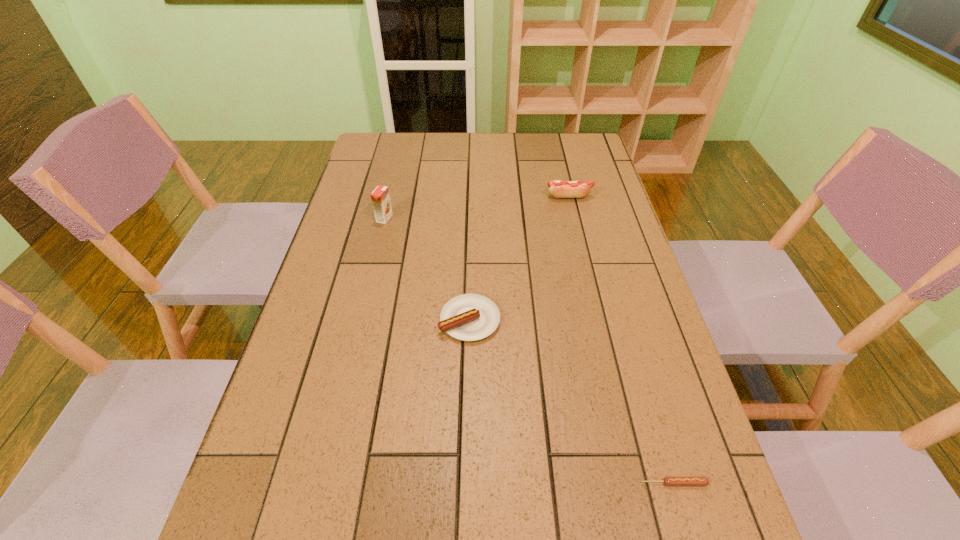
Image resolution: width=960 pixels, height=540 pixels. In order to click on the third nearest object in this screenshot , I will do `click(380, 197)`.

You are a GUI agent. You are given a task and a screenshot of the screen. Output one action in this format:
    pyautogui.click(x=<x>, y=<y>)
    Task: Click on the orange juice
    This screenshot has width=960, height=540.
    Given the screenshot: What is the action you would take?
    coord(380,197)

Where is `the farthest object`? Image resolution: width=960 pixels, height=540 pixels. the farthest object is located at coordinates (560, 189).

What are the coordinates of `the farthest sausage` in the screenshot? It's located at (560, 189).

Identify the location of the leftmost sausage. (468, 317).

Where is `the second tallest sausage`? the second tallest sausage is located at coordinates (468, 317).

Find the location of `the nearest object`. the nearest object is located at coordinates (668, 481).

Image resolution: width=960 pixels, height=540 pixels. Identify the location of the nearest sausage. (668, 481).

Locate an element on the screen. This screenshot has width=960, height=540. vacant space located on the front of the orange juice is located at coordinates (372, 272).

Image resolution: width=960 pixels, height=540 pixels. I want to click on vacant space located on the back of the second tallest object, so click(x=560, y=158).